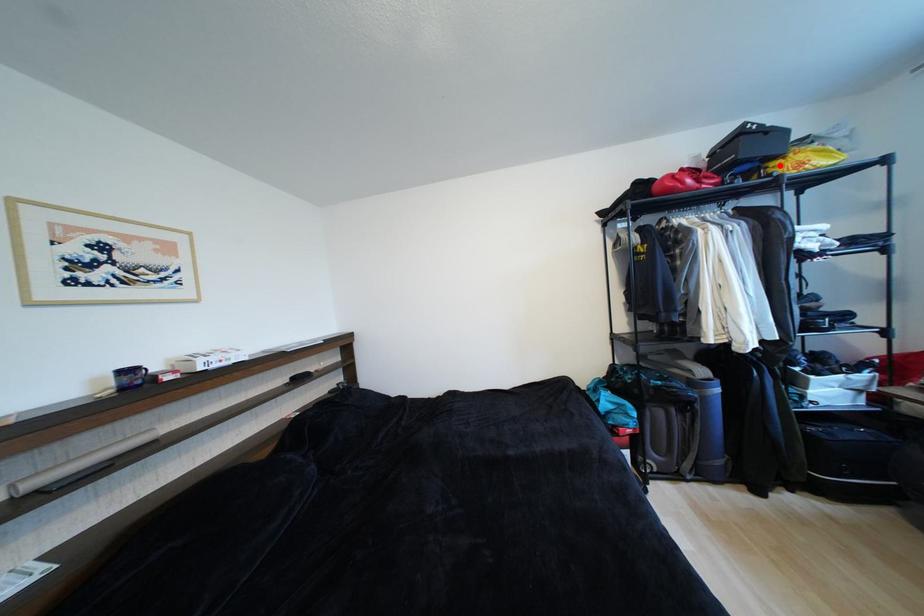
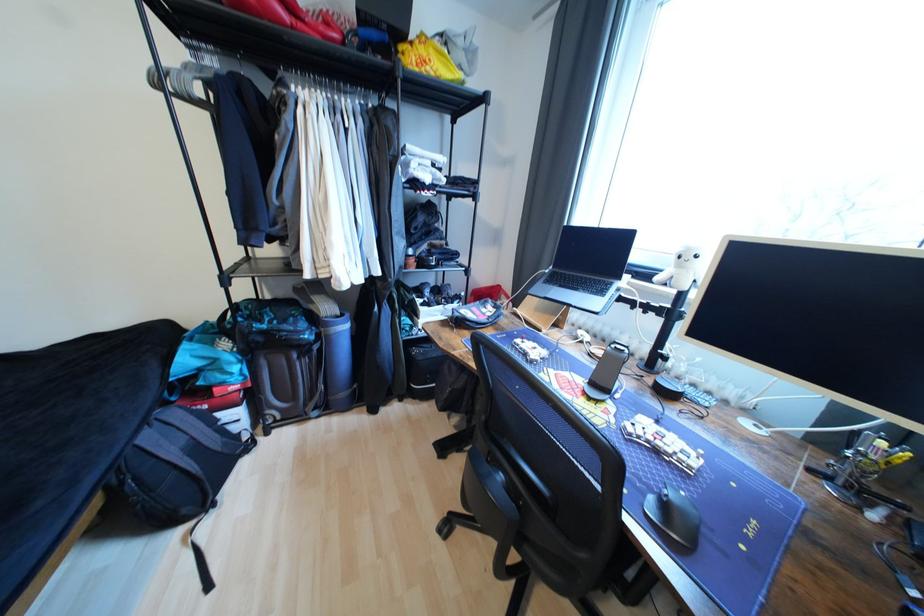
Find the pixel in the second image that matches the highlighted location in the first image.

(407, 49)